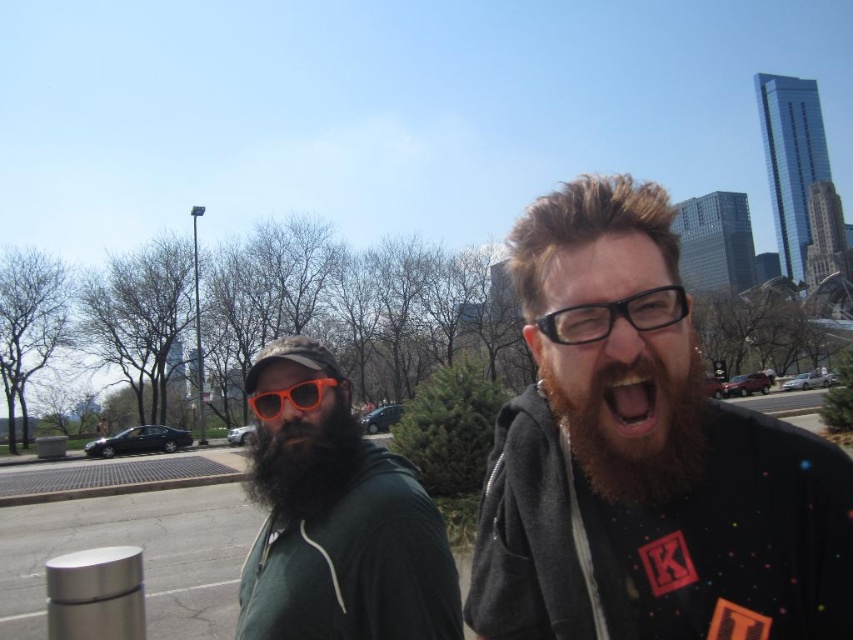
Question: Can you confirm if dark brown thick beard at center is positioned above black plastic glasses at center?

Choices:
 (A) no
 (B) yes

Answer: (A)

Question: Considering the real-world distances, which object is closest to the brownwoollybeard at right?

Choices:
 (A) green matte hoodie at center
 (B) dark brown thick beard at center
 (C) dark gray hoodie at center
 (D) orange plastic glasses at center

Answer: (C)

Question: Which object appears farthest from the camera in this image?

Choices:
 (A) brownwoollybeard at right
 (B) dark gray hoodie at center
 (C) green matte hoodie at center
 (D) black plastic glasses at center

Answer: (C)

Question: Does brownwoollybeard at right have a greater width compared to dark brown thick beard at center?

Choices:
 (A) yes
 (B) no

Answer: (B)

Question: Can you confirm if dark brown thick beard at center is positioned below orange plastic glasses at center?

Choices:
 (A) no
 (B) yes

Answer: (B)

Question: Which is nearer to the black plastic glasses at center?

Choices:
 (A) dark gray hoodie at center
 (B) green matte hoodie at center
 (C) orange plastic glasses at center

Answer: (A)